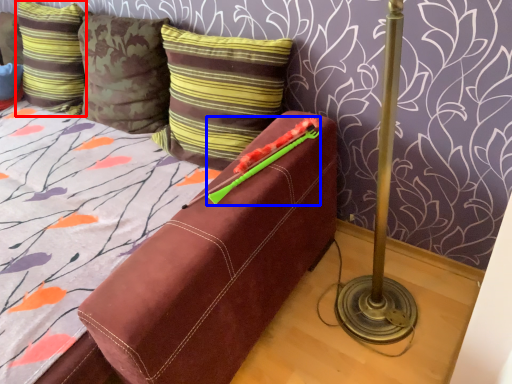
Question: Which object is further to the camera taking this photo, pillow (highlighted by a red box) or crayon (highlighted by a blue box)?

Choices:
 (A) pillow
 (B) crayon

Answer: (A)